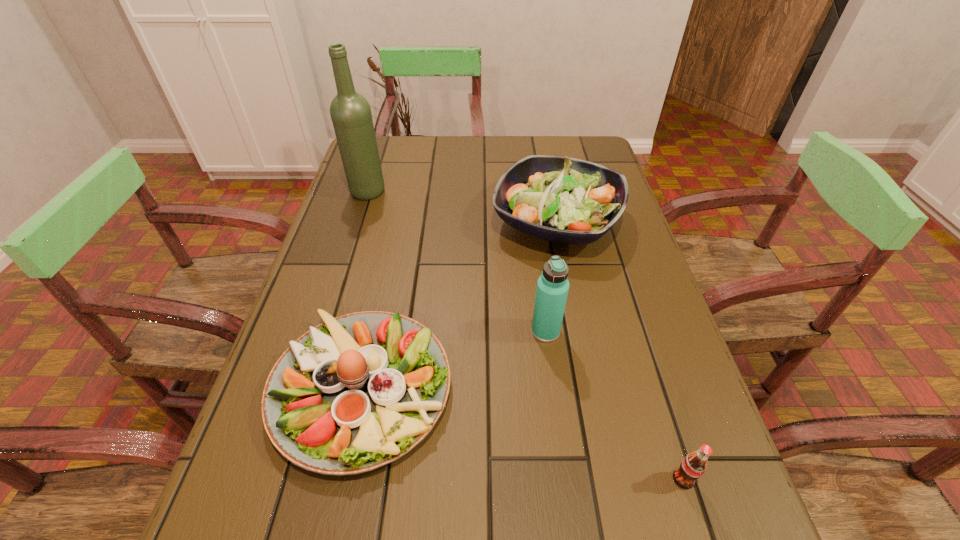
This screenshot has width=960, height=540. What are the coordinates of `wine bottle` in the screenshot? It's located at (350, 112).

Image resolution: width=960 pixels, height=540 pixels. Identify the location of thermos bottle. (552, 289).

What are the coordinates of `the taller salad plate` in the screenshot? It's located at (566, 200).

At what (x,y) coordinates should I click in order to perform the action: click on the third tallest object. Please return your answer as a coordinate pair (x, y). The width and height of the screenshot is (960, 540). Looking at the image, I should click on (566, 200).

You are a GUI agent. You are given a task and a screenshot of the screen. Output one action in this format:
    pyautogui.click(x=<x>, y=<y>)
    Task: Click on the soda
    
    Given the screenshot: What is the action you would take?
    pyautogui.click(x=693, y=466)

Find the location of a particular element. The width and height of the screenshot is (960, 540). the shorter salad plate is located at coordinates (356, 392).

What are the coordinates of `the left salad plate` in the screenshot? It's located at (356, 392).

This screenshot has height=540, width=960. Find the location of `free space located 0.280m on the right of the tallest object`. free space located 0.280m on the right of the tallest object is located at coordinates tap(484, 192).

Find the location of a particular element. The image size is (960, 540). free location located 0.110m on the left of the thermos bottle is located at coordinates (478, 331).

This screenshot has width=960, height=540. I want to click on vacant space located 0.090m on the front of the taller salad plate, so click(571, 294).